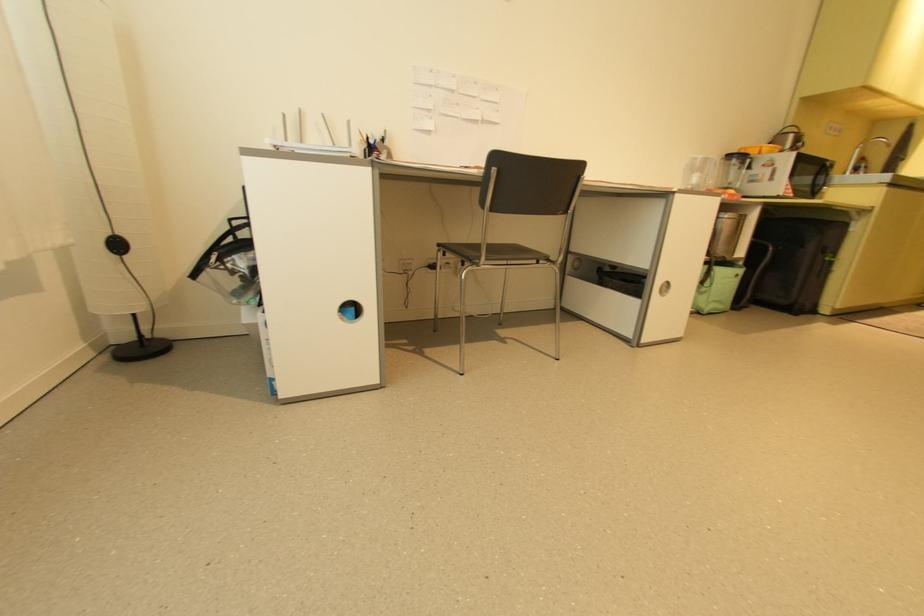
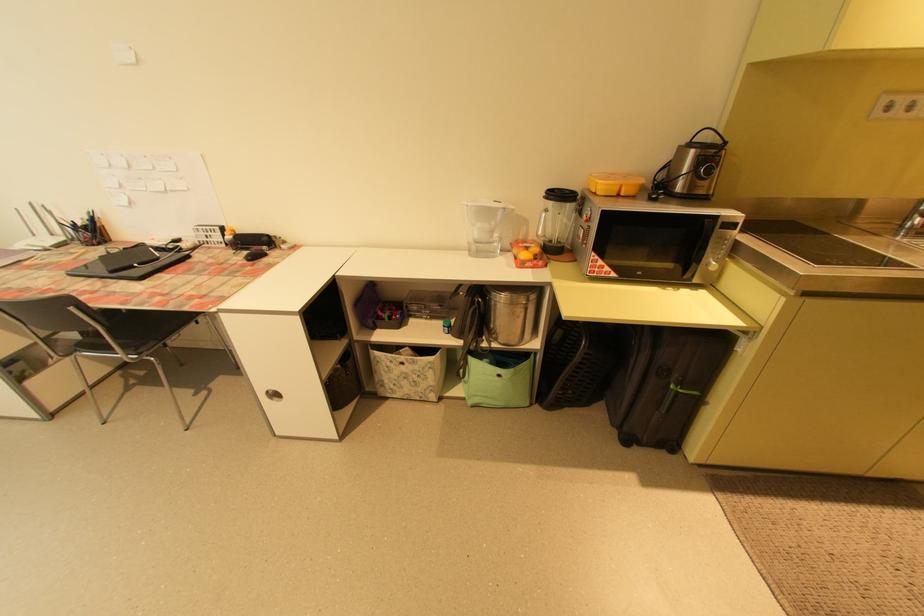
In the second image, find the point that corresponds to (833,259) in the first image.

(678, 387)